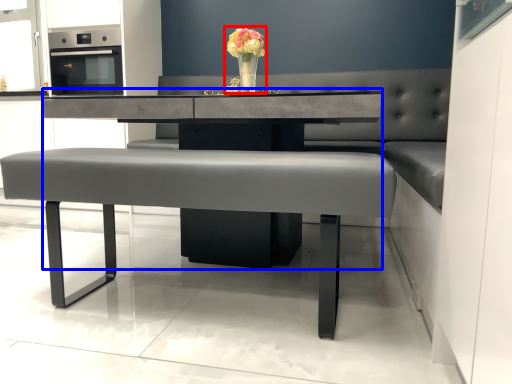
Question: Which of the following is the closest to the observer, floral arrangement (highlighted by a red box) or round table (highlighted by a blue box)?

Choices:
 (A) floral arrangement
 (B) round table

Answer: (B)